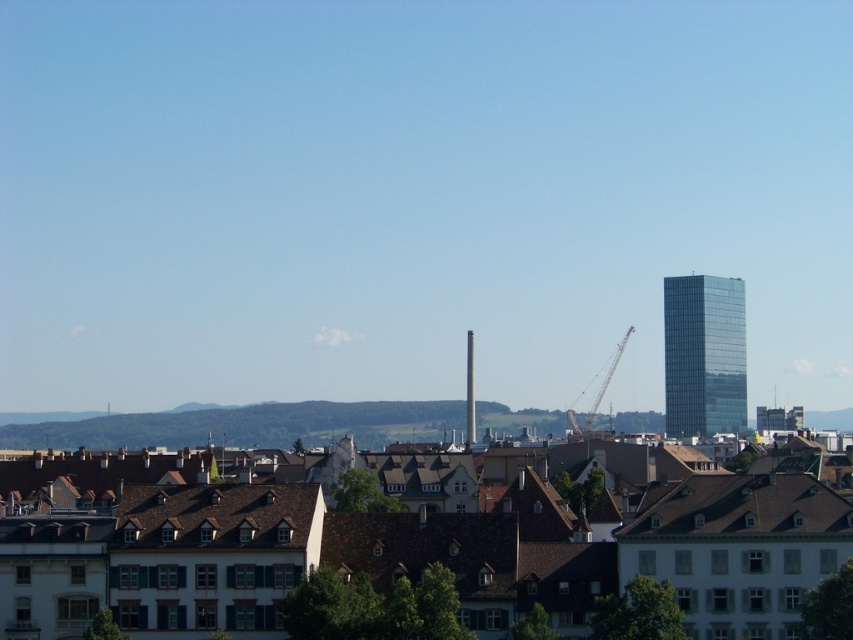
Is point (674, 316) farther from viewer compared to point (572, 412)?

No, it is not.

Which is more to the left, green glass tower at right or metallic gray crane at center?

Positioned to the left is metallic gray crane at center.

Consider the image. Who is more distant from viewer, (741, 339) or (602, 392)?

The point (602, 392) is behind.

Identify the location of green glass tower at right. The width and height of the screenshot is (853, 640). (704, 355).